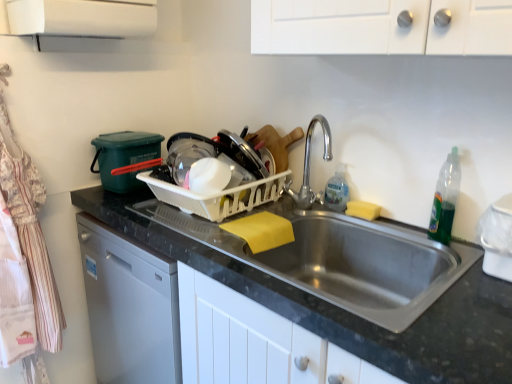
This screenshot has width=512, height=384. I want to click on vacant space in front of yellow sponge at sink right, so coord(388,228).